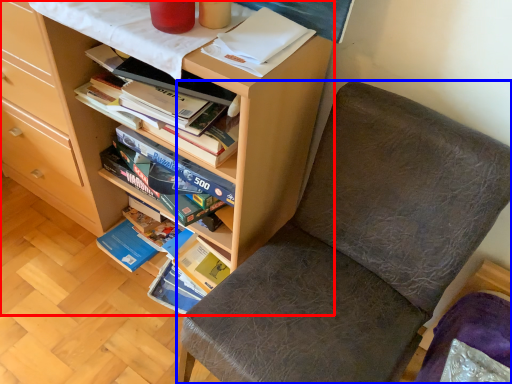
Question: Which point is further to the camera, bookcase (highlighted by a red box) or chair (highlighted by a blue box)?

Choices:
 (A) bookcase
 (B) chair

Answer: (A)